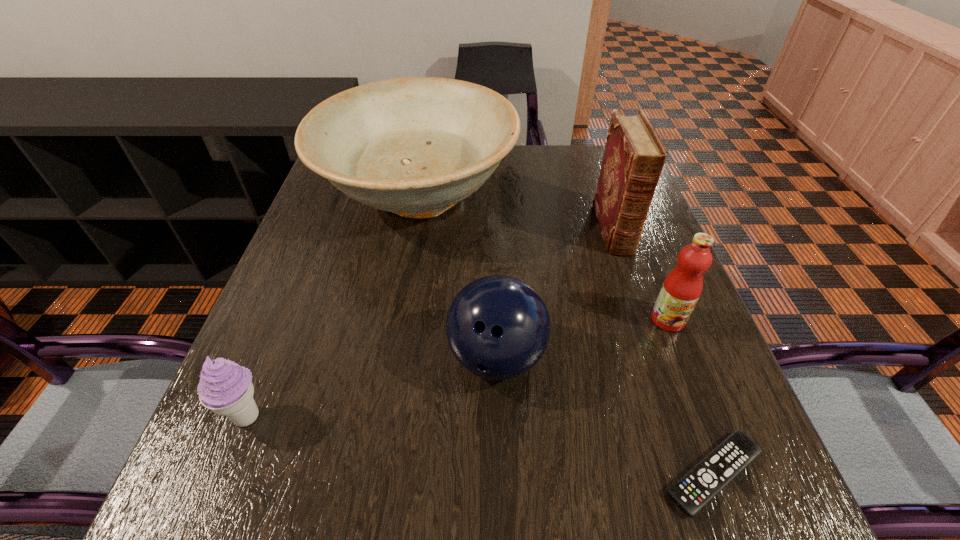
This screenshot has height=540, width=960. What are the coordinates of `vacant space located 0.050m on the right of the icecream` in the screenshot? It's located at (300, 416).

Identify the location of free region located on the left of the remote control. The width and height of the screenshot is (960, 540). (548, 474).

Where is `object present at the far edge`? object present at the far edge is located at coordinates (416, 146).

At what (x,y) coordinates should I click in order to perform the action: click on object present at the near edge. Please return your answer as a coordinate pair (x, y). The image size is (960, 540). Looking at the image, I should click on (705, 480).

Find the location of a particular element. dish positioned at the left edge is located at coordinates pyautogui.click(x=416, y=146).

The image size is (960, 540). In order to click on icecream that is at the left edge in this screenshot , I will do `click(226, 388)`.

Find the location of a particular element. hardback book that is at the right edge is located at coordinates (634, 156).

You are a GUI agent. You are given a task and a screenshot of the screen. Output one action in this format:
    pyautogui.click(x=<x>, y=<y>)
    Task: Click on the fruit juice that is at the right edge
    
    Given the screenshot: What is the action you would take?
    pyautogui.click(x=681, y=289)

Where is `remote control positioned at the right edge`? This screenshot has height=540, width=960. remote control positioned at the right edge is located at coordinates (705, 480).

Find the location of a particular element. Image resolution: width=960 pixels, height=540 pixels. object positioned at the far left corner is located at coordinates (416, 146).